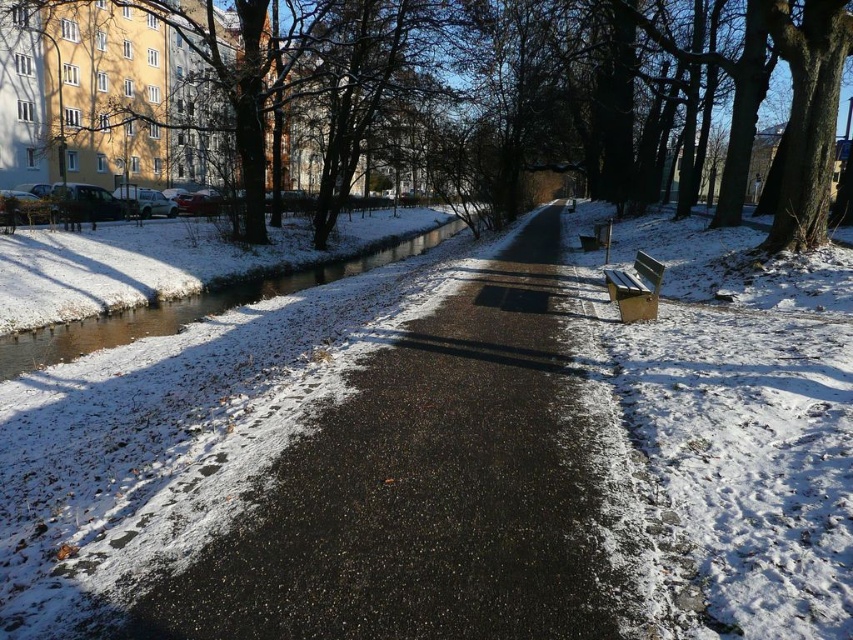
You are standing at the point where the path begins to curve to the right. You want to walk directly towards the brown textured tree at center. What direction should you head in relative to the path?

You should head to the left relative to the path to reach the brown textured tree at center.

You are a snowplow operator needing to clear snow from the black asphalt path at center and the wooden bench at right. Based on their positions, which object is lower in elevation?

The black asphalt path at center is below the wooden bench at right, so the black asphalt path at center is lower in elevation.